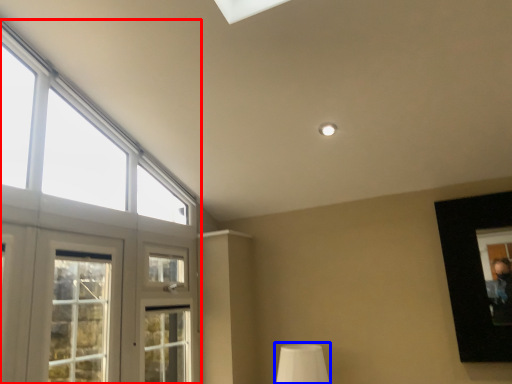
Question: Among these objects, which one is nearest to the camera, window (highlighted by a red box) or table lamp (highlighted by a blue box)?

Choices:
 (A) window
 (B) table lamp

Answer: (A)